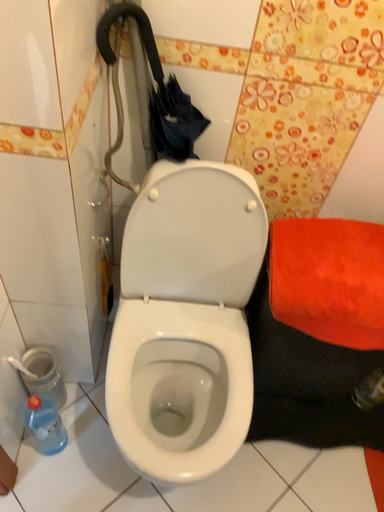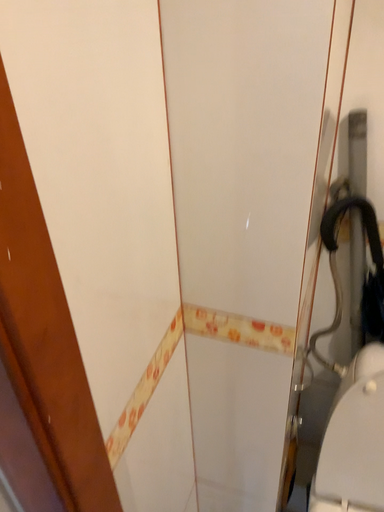
Question: How did the camera likely rotate when shooting the video?

Choices:
 (A) rotated downward
 (B) rotated upward

Answer: (B)